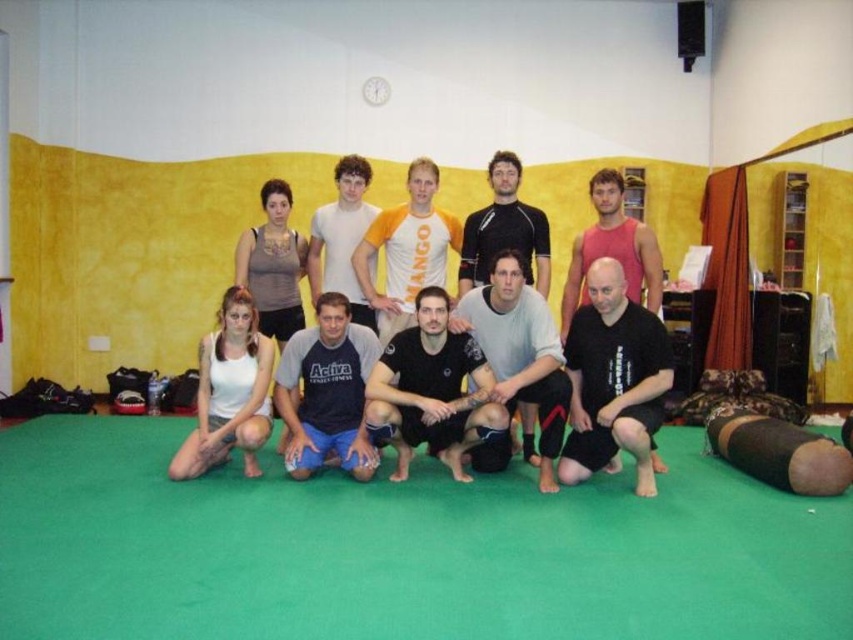
Is black matte t-shirt at center bigger than matte gray t-shirt at center?

Indeed, black matte t-shirt at center has a larger size compared to matte gray t-shirt at center.

The height and width of the screenshot is (640, 853). I want to click on black matte t-shirt at center, so click(432, 390).

Can you confirm if black matte t-shirt at center is positioned above yellow/orange jersey at center?

No, black matte t-shirt at center is not above yellow/orange jersey at center.

Is black matte t-shirt at center bigger than yellow/orange jersey at center?

Indeed, black matte t-shirt at center has a larger size compared to yellow/orange jersey at center.

In order to click on black matte t-shirt at center in this screenshot , I will do `click(432, 390)`.

This screenshot has height=640, width=853. Find the location of `black matte t-shirt at center`. black matte t-shirt at center is located at coordinates (432, 390).

Who is shorter, black matte shirt at center or white cotton t-shirt at center?

Standing shorter between the two is black matte shirt at center.

Which is behind, point (466, 241) or point (347, 182)?

The point (347, 182) is more distant.

Locate an element on the screen. This screenshot has width=853, height=640. black matte shirt at center is located at coordinates (503, 230).